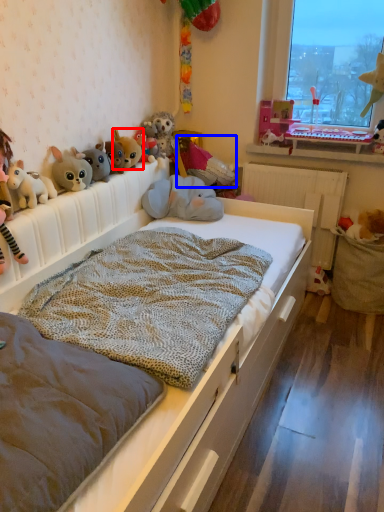
Question: Among these objects, which one is nearest to the camera, toy (highlighted by a red box) or toy (highlighted by a blue box)?

Choices:
 (A) toy
 (B) toy

Answer: (A)